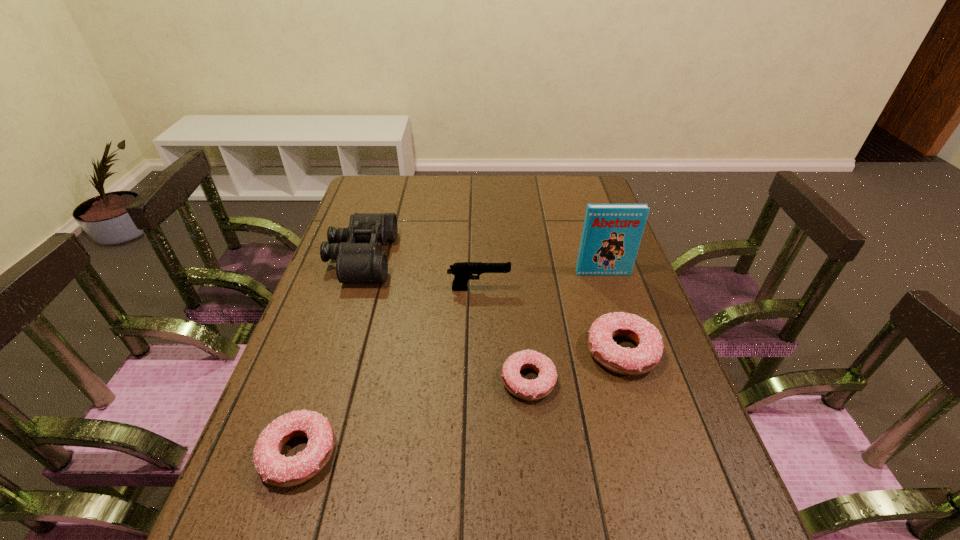
Locate an element on the screen. the second tallest doughnut is located at coordinates (275, 469).

Where is `the fifth tallest object`? the fifth tallest object is located at coordinates 275,469.

Image resolution: width=960 pixels, height=540 pixels. I want to click on the shortest object, so click(531, 390).

You are a GUI agent. You are given a task and a screenshot of the screen. Output one action in this format:
    pyautogui.click(x=<x>, y=<y>)
    Task: Click on the shortest doughnut
    The width and height of the screenshot is (960, 540).
    Given the screenshot: What is the action you would take?
    pyautogui.click(x=531, y=390)

Where is `the rightmost doughnut`? The image size is (960, 540). the rightmost doughnut is located at coordinates (645, 357).

The image size is (960, 540). What are the coordinates of `binoculars` in the screenshot? It's located at (357, 249).

Where is `the fourth shortest object`? The height and width of the screenshot is (540, 960). the fourth shortest object is located at coordinates tap(463, 271).

You are a GUI agent. You are given a task and a screenshot of the screen. Output one action in this format:
    pyautogui.click(x=<x>, y=<y>)
    Task: Click on the tallest object
    Image resolution: width=960 pixels, height=540 pixels.
    Given the screenshot: What is the action you would take?
    pyautogui.click(x=611, y=236)

This screenshot has height=540, width=960. Find the location of `free spot located 0.320m on the back of the leftmost doughnut`. free spot located 0.320m on the back of the leftmost doughnut is located at coordinates (345, 313).

Where is `vacant space located on the front of the second doughnut from left to right`? This screenshot has width=960, height=540. vacant space located on the front of the second doughnut from left to right is located at coordinates (537, 468).